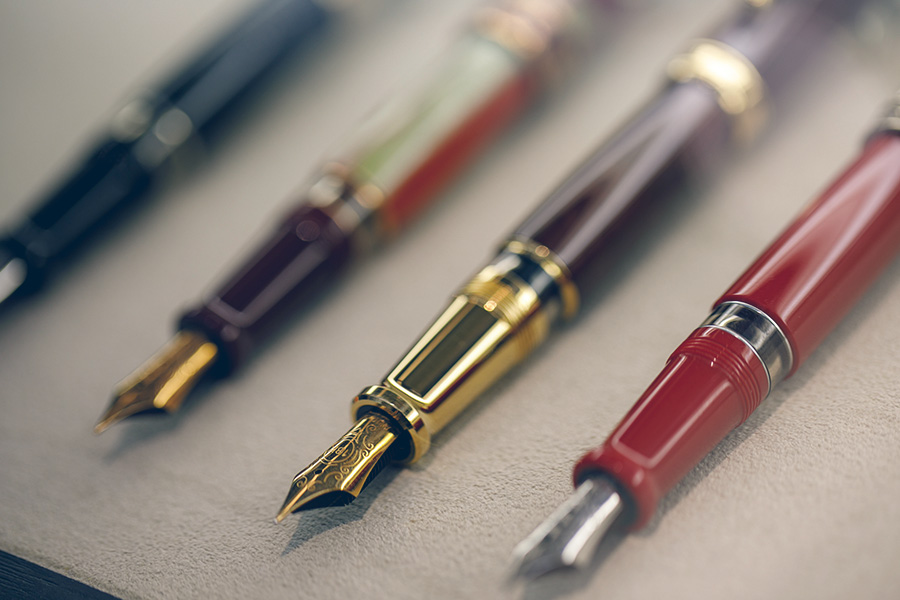
At what (x,y) coordinates should I click in order to perform the action: click on pens. Please return your answer as a coordinate pair (x, y). Looking at the image, I should click on (716, 357), (526, 304), (295, 229), (174, 172).